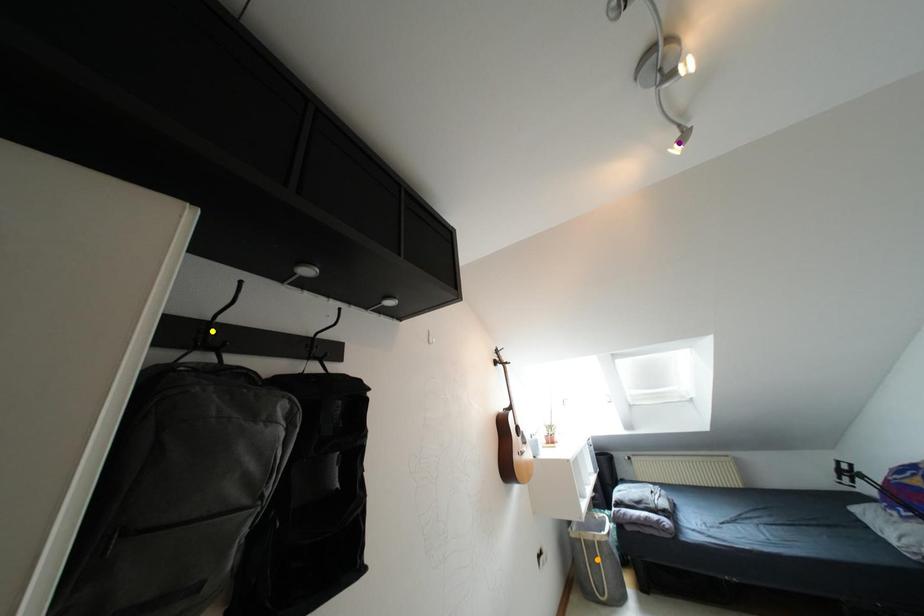
Order these from nearest to farthest:
A) yellow point
B) orange point
C) purple point

yellow point < purple point < orange point